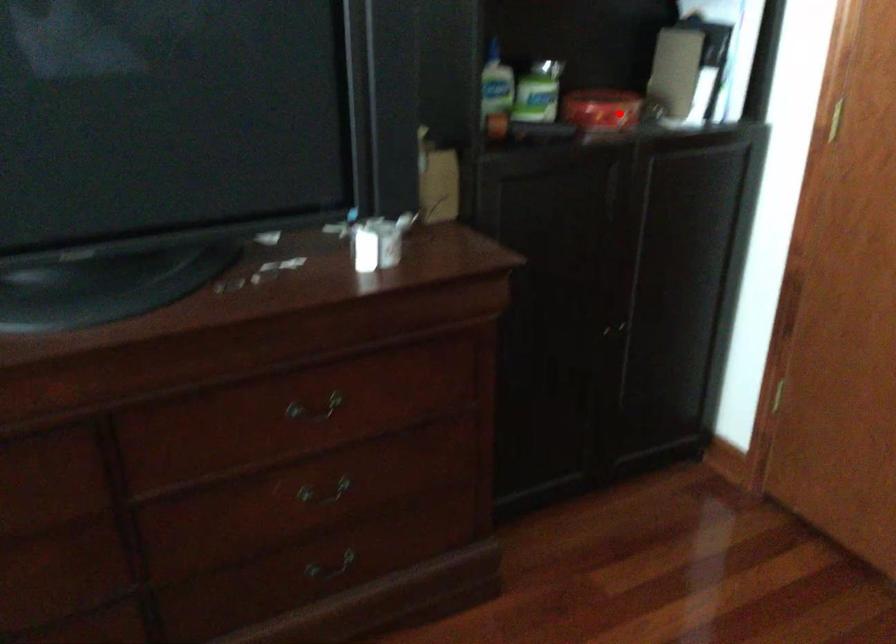
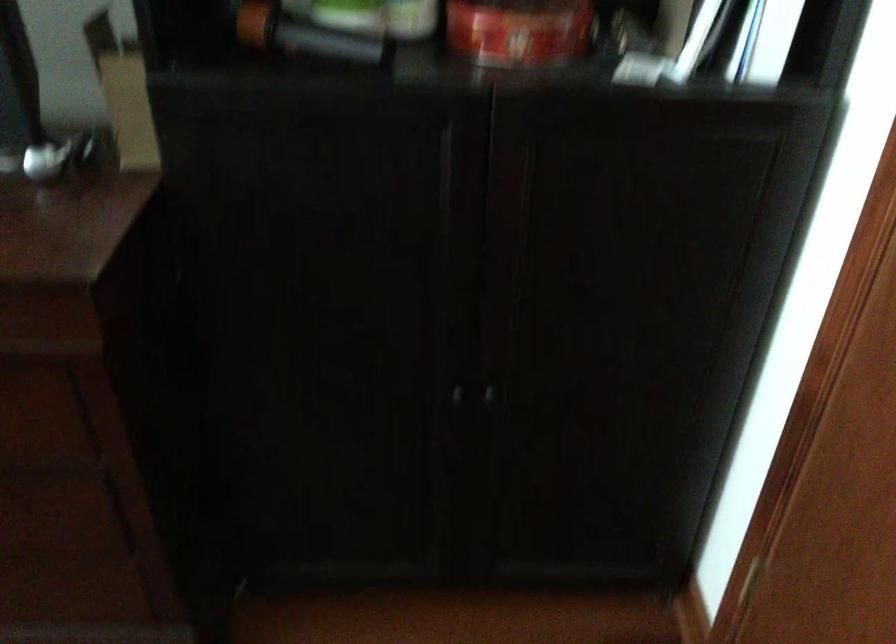
Question: I am providing you with two images of the same scene from different viewpoints. A red point is marked on the first image. Can you still see the location of the red point in image 2?

Choices:
 (A) Yes
 (B) No

Answer: (A)